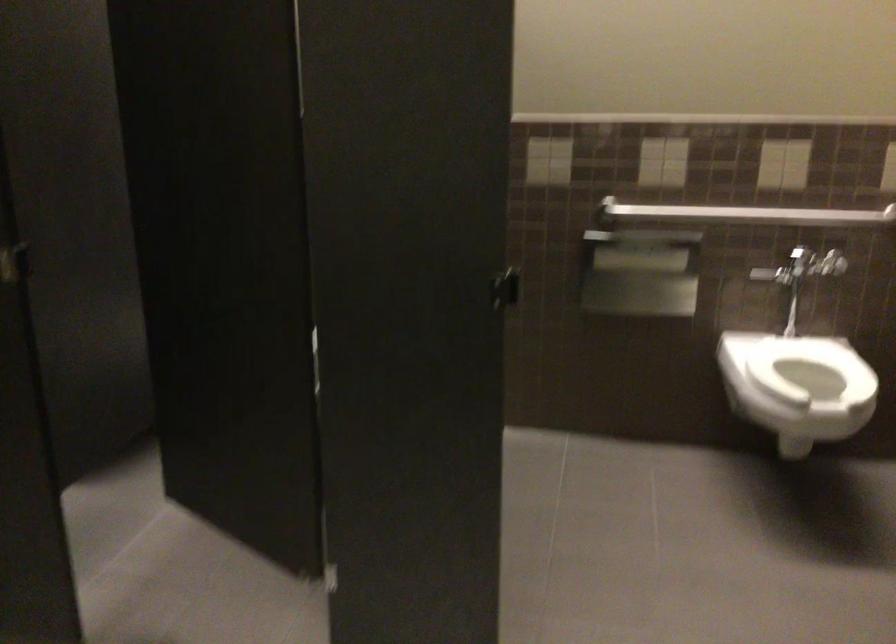
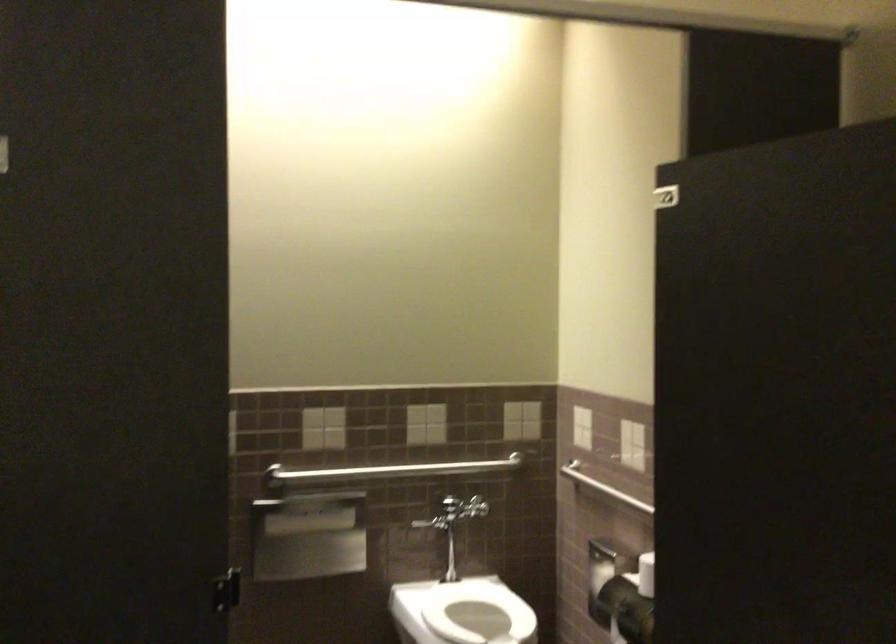
The first image is from the beginning of the video and the second image is from the end. How did the camera likely rotate when shooting the video?

The camera's rotation is toward right-up.